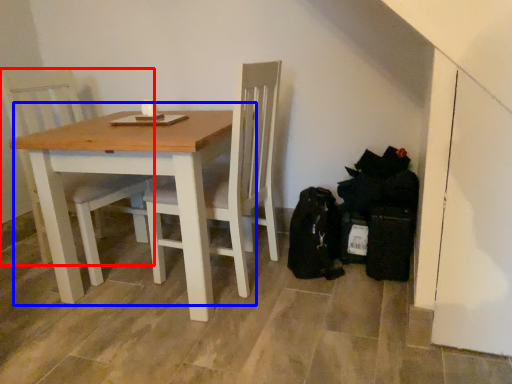
Question: Which point is closer to the camera, chair (highlighted by a red box) or table (highlighted by a blue box)?

Choices:
 (A) chair
 (B) table

Answer: (B)